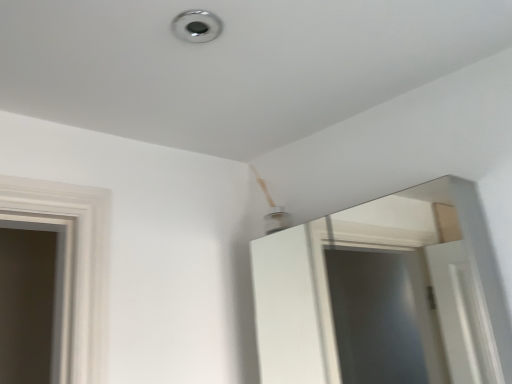
Question: Is chrome metallic light at upper center at the left side of white glossy mirror at upper center?

Choices:
 (A) no
 (B) yes

Answer: (B)

Question: Is white glossy mirror at upper center inside chrome metallic light at upper center?

Choices:
 (A) no
 (B) yes

Answer: (A)

Question: Considering the relative sizes of chrome metallic light at upper center and white glossy mirror at upper center in the image provided, is chrome metallic light at upper center smaller than white glossy mirror at upper center?

Choices:
 (A) yes
 (B) no

Answer: (A)

Question: Is chrome metallic light at upper center thinner than white glossy mirror at upper center?

Choices:
 (A) no
 (B) yes

Answer: (B)

Question: Does chrome metallic light at upper center lie behind white glossy mirror at upper center?

Choices:
 (A) no
 (B) yes

Answer: (B)

Question: From a real-world perspective, is chrome metallic light at upper center beneath white glossy mirror at upper center?

Choices:
 (A) no
 (B) yes

Answer: (A)

Question: From a real-world perspective, is white glossy mirror at upper center physically below chrome metallic light at upper center?

Choices:
 (A) yes
 (B) no

Answer: (A)

Question: From the image's perspective, is white glossy mirror at upper center located beneath chrome metallic light at upper center?

Choices:
 (A) yes
 (B) no

Answer: (A)

Question: Is white glossy mirror at upper center touching chrome metallic light at upper center?

Choices:
 (A) no
 (B) yes

Answer: (A)

Question: Is white glossy mirror at upper center outside chrome metallic light at upper center?

Choices:
 (A) yes
 (B) no

Answer: (A)

Question: Is white glossy mirror at upper center closer to camera compared to chrome metallic light at upper center?

Choices:
 (A) yes
 (B) no

Answer: (A)

Question: From a real-world perspective, is white glossy mirror at upper center over chrome metallic light at upper center?

Choices:
 (A) yes
 (B) no

Answer: (B)

Question: Is chrome metallic light at upper center bigger or smaller than white glossy mirror at upper center?

Choices:
 (A) big
 (B) small

Answer: (B)